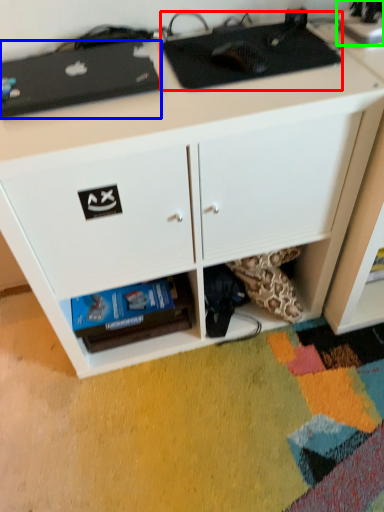
Question: Considering the real-world distances, which object is closest to appliance (highlighted by a red box)? appliance (highlighted by a blue box) or appliance (highlighted by a green box).

Choices:
 (A) appliance
 (B) appliance

Answer: (A)